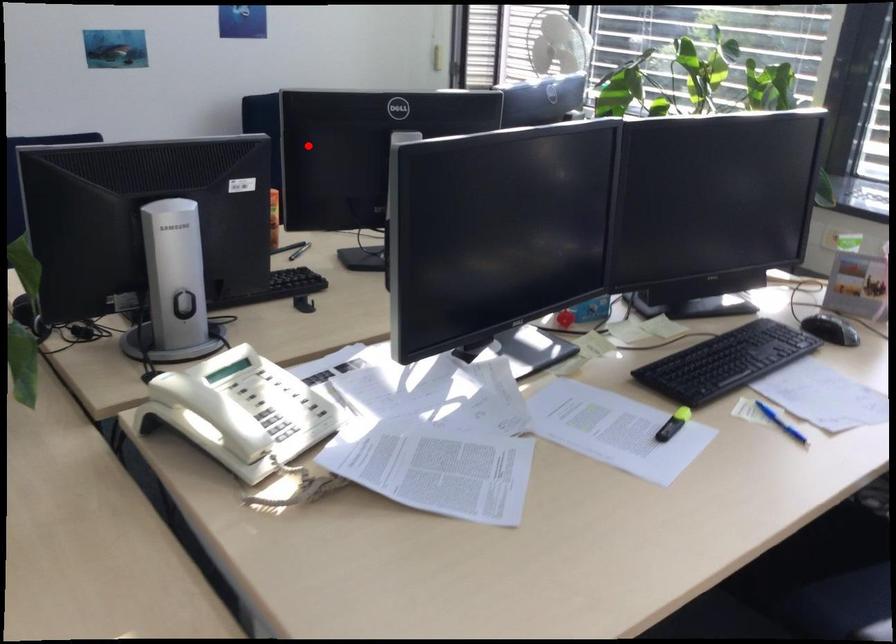
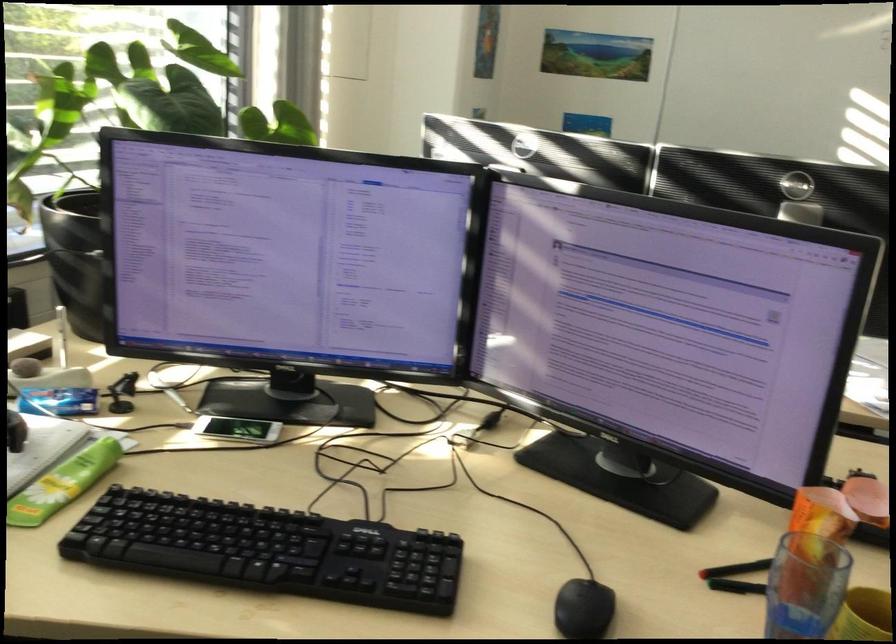
Question: I am providing you with two images of the same scene from different viewpoints. A red point is marked on the first image. Is the red point's position out of view in image 2?

Choices:
 (A) Yes
 (B) No

Answer: (B)